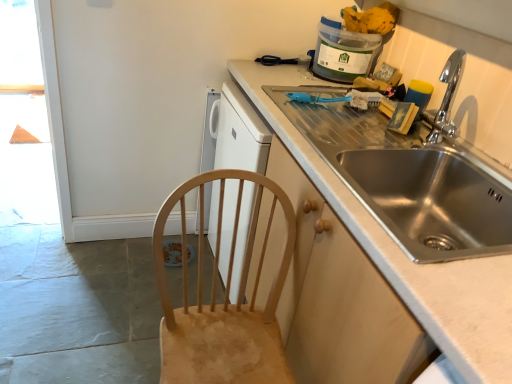
Question: Considering the positions of point (260, 187) and point (482, 370), is point (260, 187) closer or farther from the camera than point (482, 370)?

Choices:
 (A) closer
 (B) farther

Answer: (B)

Question: Would you say natural wood chair at lower left is to the left or to the right of stainless steel sink at right in the picture?

Choices:
 (A) right
 (B) left

Answer: (B)

Question: Considering the real-world distances, which object is closest to the natural wood chair at lower left?

Choices:
 (A) stainless steel sink at right
 (B) translucent plastic container at upper right

Answer: (A)

Question: Which is nearer to the natural wood chair at lower left?

Choices:
 (A) stainless steel sink at right
 (B) translucent plastic container at upper right

Answer: (A)